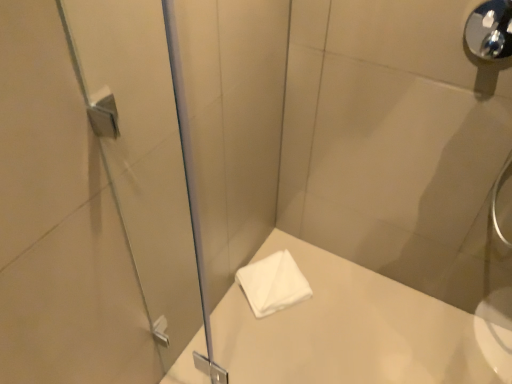
Question: From their relative heights in the image, would you say transparent glass screen door at left is taller or shorter than polished chrome shower handle at upper right?

Choices:
 (A) tall
 (B) short

Answer: (A)

Question: Is transparent glass screen door at left inside or outside of polished chrome shower handle at upper right?

Choices:
 (A) outside
 (B) inside

Answer: (A)

Question: Which object is the farthest from the transparent glass screen door at left?

Choices:
 (A) white soft towel at center
 (B) polished chrome shower handle at upper right

Answer: (B)

Question: Considering the real-world distances, which object is closest to the transparent glass screen door at left?

Choices:
 (A) polished chrome shower handle at upper right
 (B) white soft towel at center

Answer: (B)